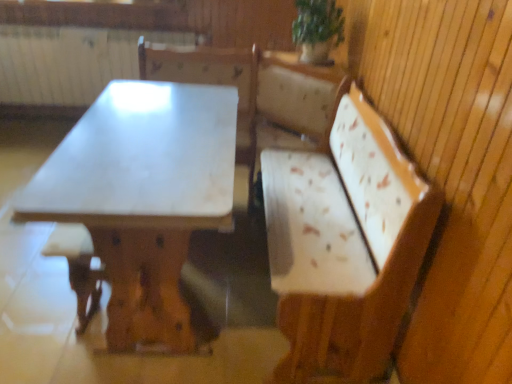
This screenshot has height=384, width=512. Identify the location of vacant area that is in front of brown wood step stool at lower left. (74, 360).